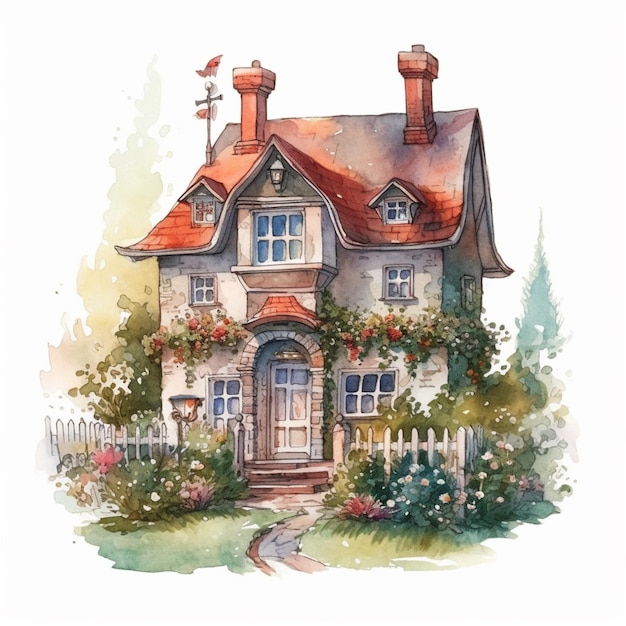
At what (x,y) coordinates should I click in order to perform the action: click on walk way. Please return your answer as a coordinate pair (x, y). Looking at the image, I should click on (287, 534).